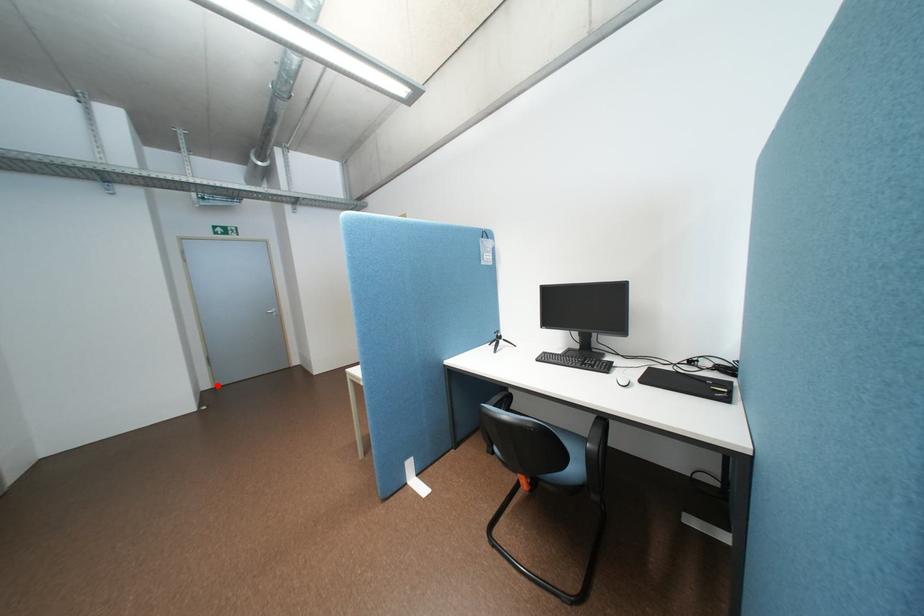
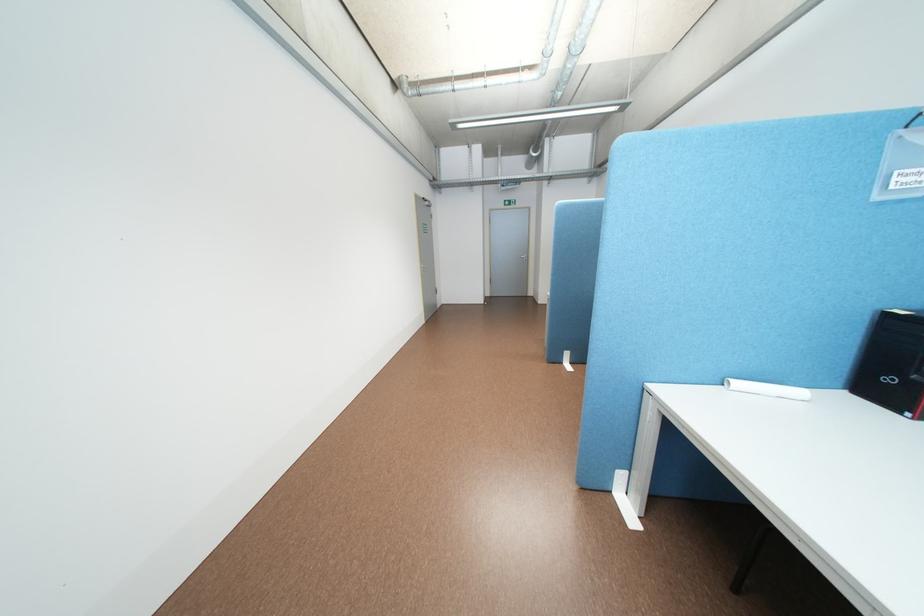
The point at the highlighted location is marked in the first image. Where is the corresponding point in the second image?

(499, 294)